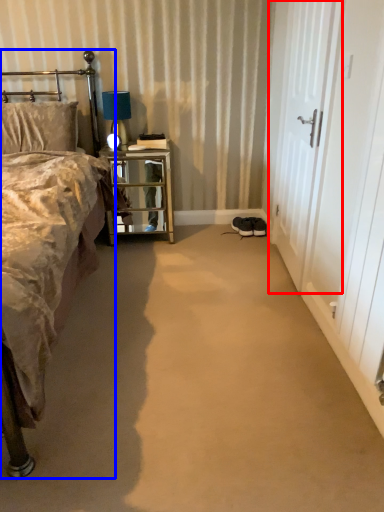
Question: Which object is further to the camera taking this photo, screen door (highlighted by a red box) or bed (highlighted by a blue box)?

Choices:
 (A) screen door
 (B) bed

Answer: (A)